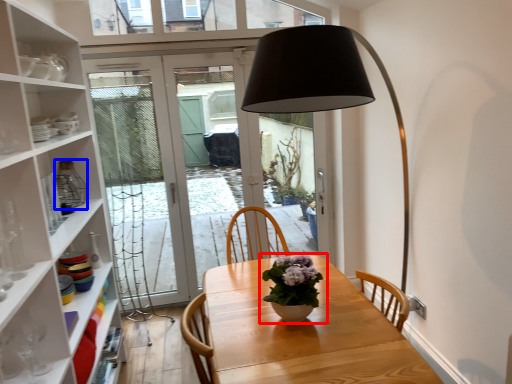
Question: Among these objects, which one is nearest to the camera, houseplant (highlighted by a red box) or glass vase (highlighted by a blue box)?

Choices:
 (A) houseplant
 (B) glass vase

Answer: (A)